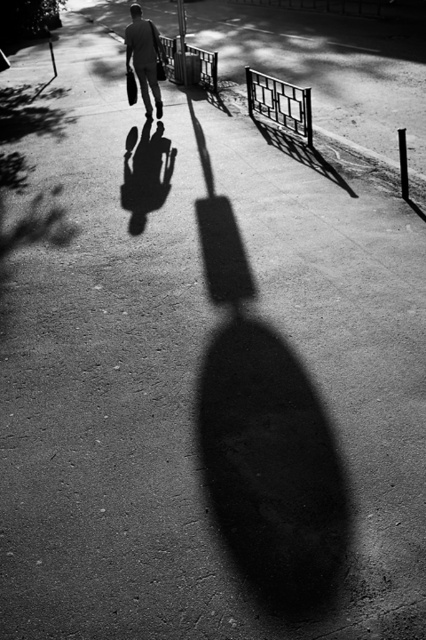
You are standing on the sidewalk and want to walk towards the metallic grid fence at upper center. Is the dark gray suit at center blocking your path?

The metallic grid fence at upper center is closer to the viewer than the dark gray suit at center, so the dark gray suit at center is behind the fence and not blocking your path.

You are standing on the sidewalk and see two points marked on the ground. One is at coordinate point(296, 90) and the other at point(201, 76). Which point is closer to you?

Point(296, 90) is closer to the viewer than point(201, 76).

You are standing on the sidewalk and want to exit through the gate. The metallic grid fence at upper center has a specific location. Can you determine if the gate is to your left or right based on the fence position?

The metallic grid fence at upper center is located at point (279, 104), which would place it slightly to the left side of the scene. Therefore, the gate is to your left.